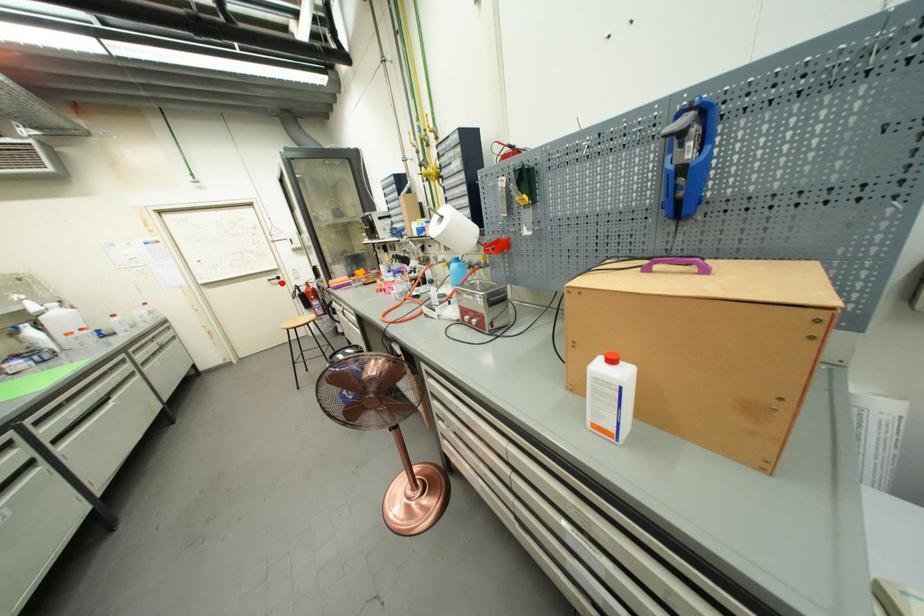
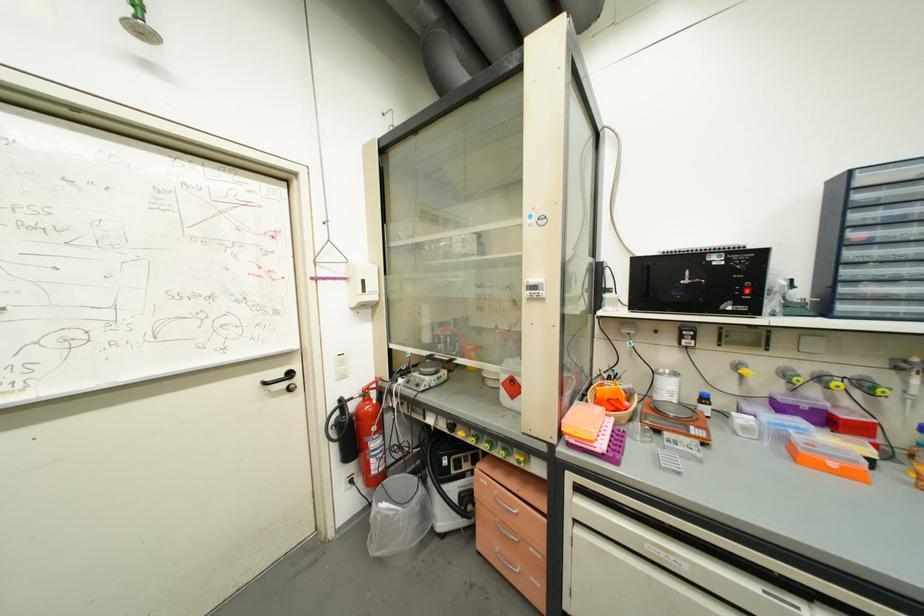
The point at the highlighted location is marked in the first image. Where is the corresponding point in the second image?

(289, 387)